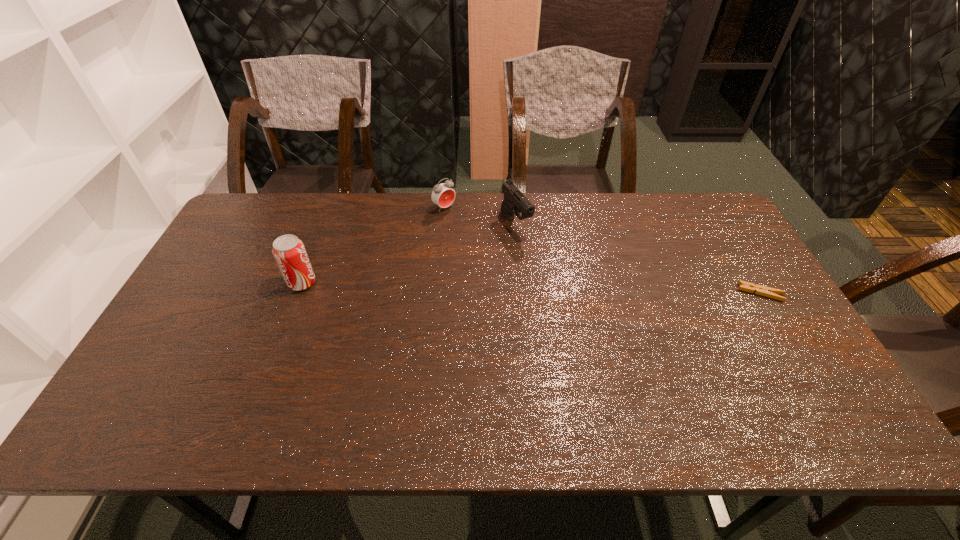
This screenshot has height=540, width=960. I want to click on free space at the far left corner, so click(x=246, y=204).

At what (x,y) coordinates should I click in order to perform the action: click on free location at the near left corner. Please return your answer as a coordinate pair (x, y). Looking at the image, I should click on (189, 376).

Identify the location of free space at the near right corner. (812, 393).

Where is `free area in between the third object from right to left and the pistol`? This screenshot has width=960, height=540. free area in between the third object from right to left and the pistol is located at coordinates (480, 216).

The width and height of the screenshot is (960, 540). What are the coordinates of `vacant area between the pistol and the soda can` in the screenshot? It's located at (409, 253).

Where is `vacant point located between the third object from left to right and the second object from left to right`? vacant point located between the third object from left to right and the second object from left to right is located at coordinates (480, 216).

Where is `free area in between the clothespin and the soda can`? The image size is (960, 540). free area in between the clothespin and the soda can is located at coordinates (532, 288).

What are the coordinates of `free space between the leftmost object and the alarm clock` in the screenshot? It's located at (373, 245).

Identify the location of vacant area that lies between the second object from left to right and the soda can. The width and height of the screenshot is (960, 540). (373, 245).

You are a GUI agent. You are given a task and a screenshot of the screen. Output one action in this format:
    pyautogui.click(x=<x>, y=<y>)
    Task: Click on the unoccupied area between the rightmost object and the pistol
    This screenshot has width=960, height=540.
    Given the screenshot: What is the action you would take?
    pyautogui.click(x=638, y=258)